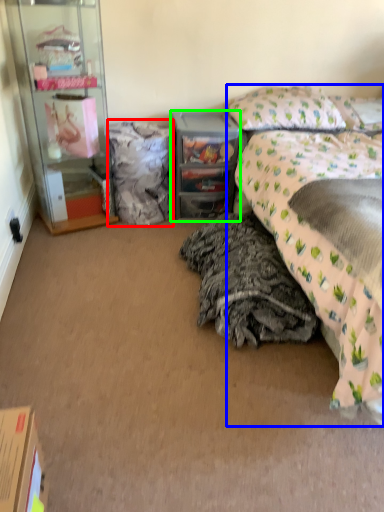
Question: Estimate the real-world distances between objects in this image. Which object is closer to material (highlighted by a red box), bed (highlighted by a blue box) or desk (highlighted by a green box)?

Choices:
 (A) bed
 (B) desk

Answer: (B)